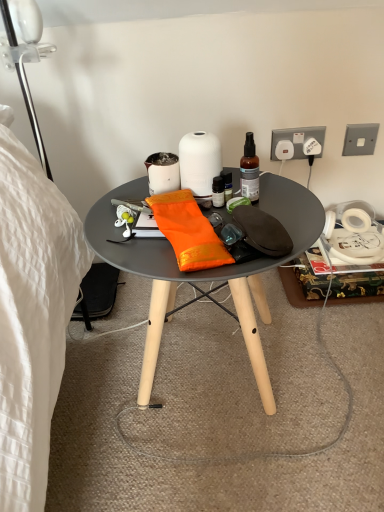
Identify the location of free point to the right of matte black table at center. (338, 359).